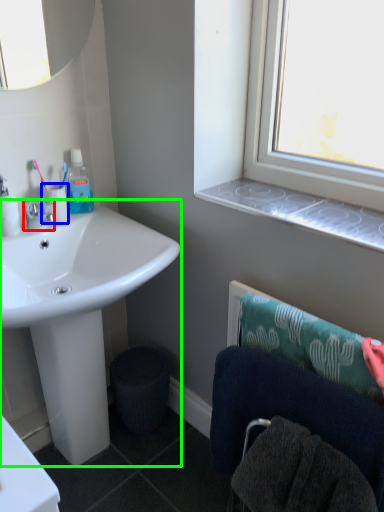
Question: Based on their relative distances, which object is farther from tap (highlighted by a red box)? Choose from toilet paper (highlighted by a blue box) and sink (highlighted by a green box).

Choices:
 (A) toilet paper
 (B) sink

Answer: (B)